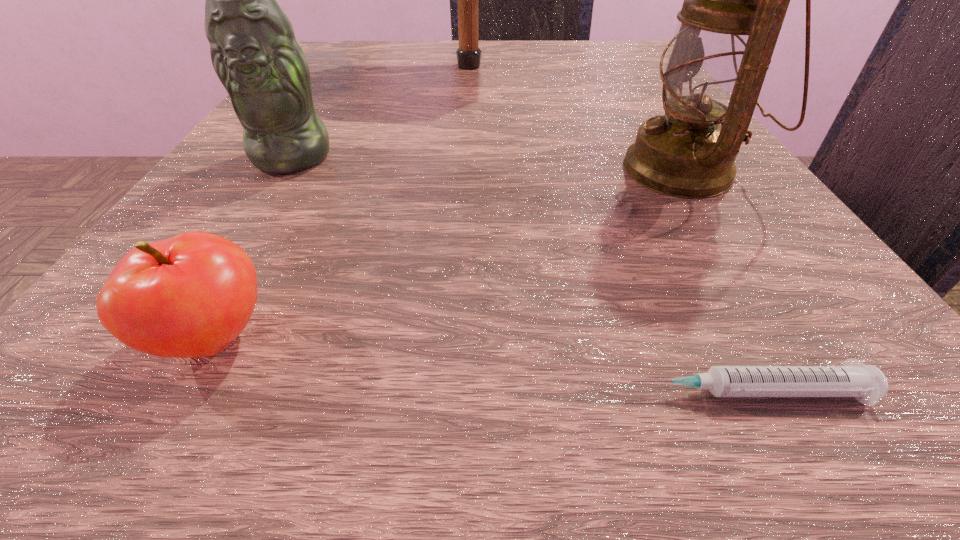
At what (x,y) coordinates should I click in order to perform the action: click on vacant space situated 0.090m at the needle end of the syringe. Please return your answer as a coordinate pair (x, y). The image size is (960, 540). Looking at the image, I should click on (503, 392).

I want to click on vacant space situated at the needle end of the syringe, so click(x=132, y=392).

The width and height of the screenshot is (960, 540). Identify the location of blank area located at the needle end of the syringe. (104, 392).

Find the location of a particular element. The width and height of the screenshot is (960, 540). object that is at the far edge is located at coordinates (468, 54).

The height and width of the screenshot is (540, 960). I want to click on apple located in the near edge section of the desktop, so click(x=189, y=296).

This screenshot has width=960, height=540. I want to click on syringe located in the near edge section of the desktop, so click(x=866, y=383).

Locate an element on the screen. beer bottle located at the left edge is located at coordinates (254, 52).

Where is `apple located at the left edge`? This screenshot has height=540, width=960. apple located at the left edge is located at coordinates (189, 296).

You are a GUI agent. You are given a task and a screenshot of the screen. Output one action in this format:
    pyautogui.click(x=<x>, y=<y>)
    Task: Click on the oil lamp present at the right edge
    This screenshot has width=960, height=540.
    Given the screenshot: What is the action you would take?
    click(x=735, y=0)

At what (x,y) coordinates should I click in order to perform the action: click on syringe at the right edge. Please return your answer as a coordinate pair (x, y). Looking at the image, I should click on (866, 383).